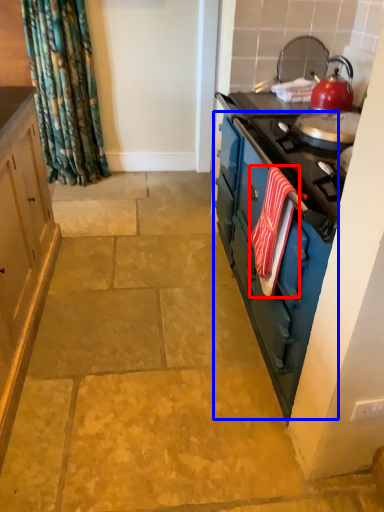
Question: Among these objects, which one is nearest to the camera, beach towel (highlighted by a red box) or dresser (highlighted by a blue box)?

Choices:
 (A) beach towel
 (B) dresser

Answer: (B)